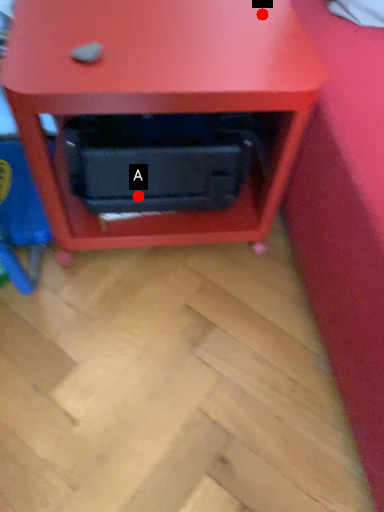
Question: Two points are circled on the image, labeled by A and B beside each circle. Which of the following is the closest to the observer?

Choices:
 (A) A is closer
 (B) B is closer

Answer: (B)